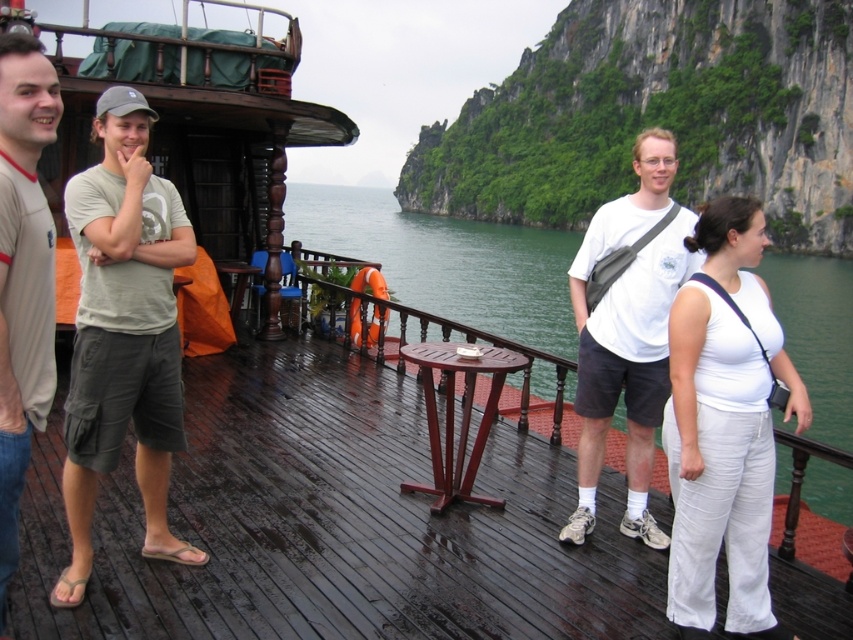
Question: Can you confirm if green water at center is positioned below light brown t-shirt at left?

Choices:
 (A) yes
 (B) no

Answer: (B)

Question: Which of these objects is positioned farthest from the light brown t-shirt at left?

Choices:
 (A) light gray cotton t-shirt at left
 (B) white cotton pants at center

Answer: (B)

Question: Among these points, which one is farthest from the camera?

Choices:
 (A) (830, 285)
 (B) (590, 236)
 (C) (770, 420)
 (D) (67, 358)

Answer: (A)

Question: Can you confirm if white matte shirt at center is bigger than light brown t-shirt at left?

Choices:
 (A) no
 (B) yes

Answer: (B)

Question: Does wooden deck at center appear under light gray cotton t-shirt at left?

Choices:
 (A) yes
 (B) no

Answer: (A)

Question: Which object appears closest to the camera in this image?

Choices:
 (A) white cotton pants at center
 (B) green water at center

Answer: (A)